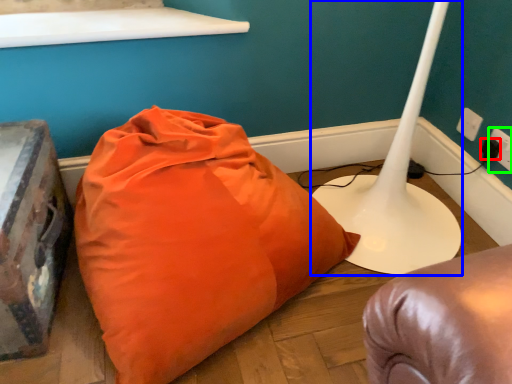
Question: Which is nearer to the plug (highlighted by a red box)? table lamp (highlighted by a blue box) or electric outlet (highlighted by a green box).

Choices:
 (A) table lamp
 (B) electric outlet

Answer: (B)